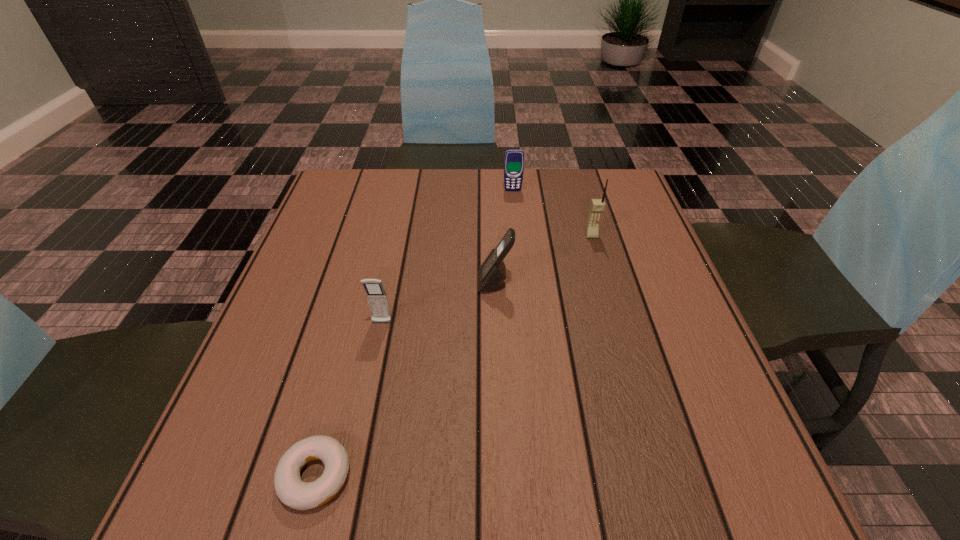
Find the location of a particular element. This screenshot has height=540, width=960. vacant space situated 0.240m on the front-facing side of the third nearest object is located at coordinates (368, 283).

The height and width of the screenshot is (540, 960). I want to click on free spot located on the front-facing side of the third nearest object, so click(427, 283).

Find the location of a particular element. Image resolution: width=960 pixels, height=540 pixels. vacant space located 0.120m on the front-facing side of the nearest cellular telephone is located at coordinates (371, 378).

Locate an element on the screen. vacant area situated on the front-facing side of the farthest object is located at coordinates (521, 284).

At what (x,y) coordinates should I click in order to perform the action: click on blank area located on the right of the doughnut. Please return your answer as a coordinate pair (x, y). This screenshot has height=540, width=960. Looking at the image, I should click on (444, 476).

The image size is (960, 540). I want to click on object that is positioned at the far edge, so click(x=514, y=158).

Find the location of a particular element. The image size is (960, 540). object located in the near edge section of the desktop is located at coordinates (291, 490).

This screenshot has height=540, width=960. Find the location of `object located in the left edge section of the desktop`. object located in the left edge section of the desktop is located at coordinates (291, 490).

Locate an element on the screen. The height and width of the screenshot is (540, 960). object at the right edge is located at coordinates (597, 206).

Where is `object situated at the near left corner`? object situated at the near left corner is located at coordinates (291, 490).